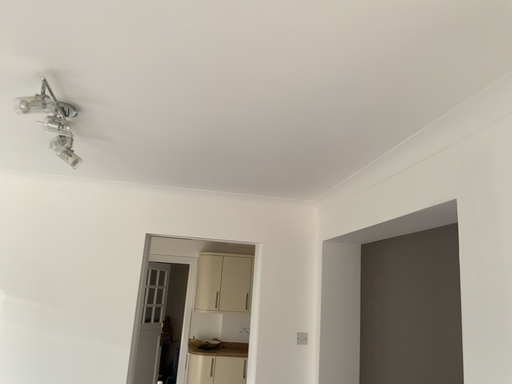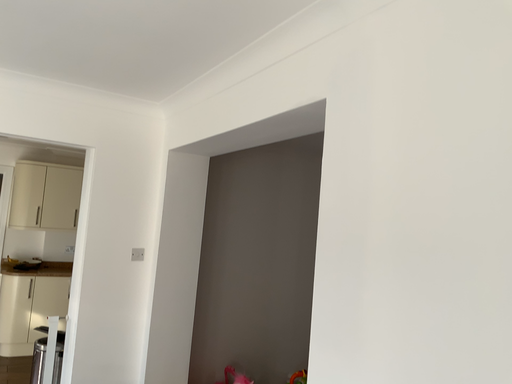
Question: Which way did the camera rotate in the video?

Choices:
 (A) rotated right
 (B) rotated left

Answer: (A)